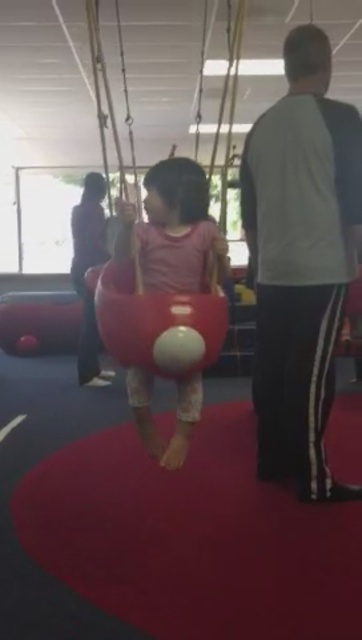
Between point (295, 464) and point (125, 308), which one is positioned in front?

Point (125, 308)

Is white/black track pants at right shorter than matte plastic swing at center?

No.

Which is in front, point (279, 436) or point (119, 355)?

Point (119, 355) is more forward.

The height and width of the screenshot is (640, 362). I want to click on white/black track pants at right, so click(300, 260).

Can you confirm if white/black track pants at right is smaller than matte pink swing at center?

No, white/black track pants at right is not smaller than matte pink swing at center.

Find the location of a particular element. The width and height of the screenshot is (362, 640). white/black track pants at right is located at coordinates (300, 260).

Which of these two, matte pink swing at center or matte plastic swing at center, stands shorter?

Standing shorter between the two is matte plastic swing at center.

You are a GUI agent. You are given a task and a screenshot of the screen. Output one action in this format:
    pyautogui.click(x=<x>, y=<y>)
    Task: Click on the matte pink swing at center
    
    Given the screenshot: What is the action you would take?
    pyautogui.click(x=174, y=228)